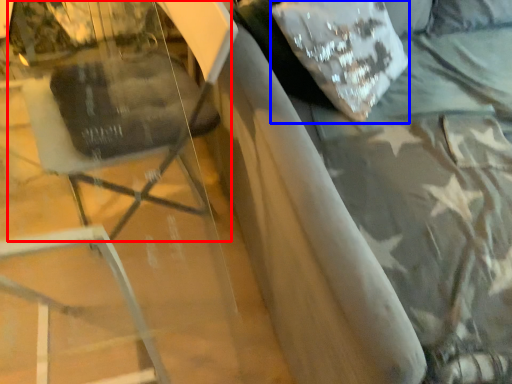
Question: Which object is closer to the camera taking this photo, swivel chair (highlighted by a red box) or pillow (highlighted by a blue box)?

Choices:
 (A) swivel chair
 (B) pillow

Answer: (A)